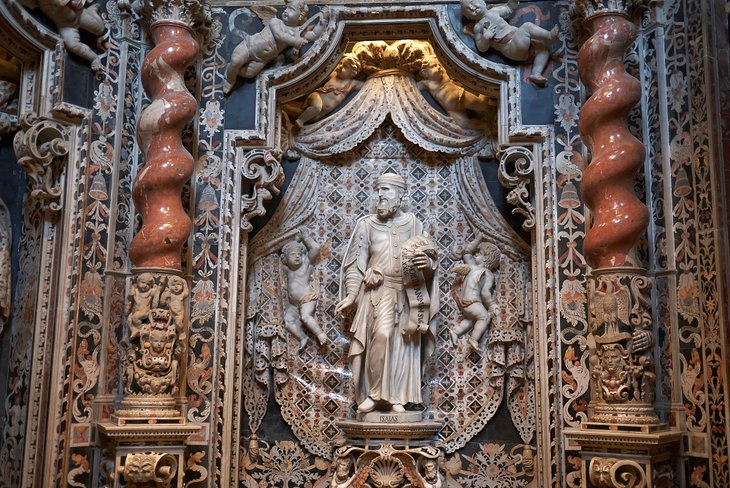
Locate an element on the screen. light is located at coordinates (361, 42).